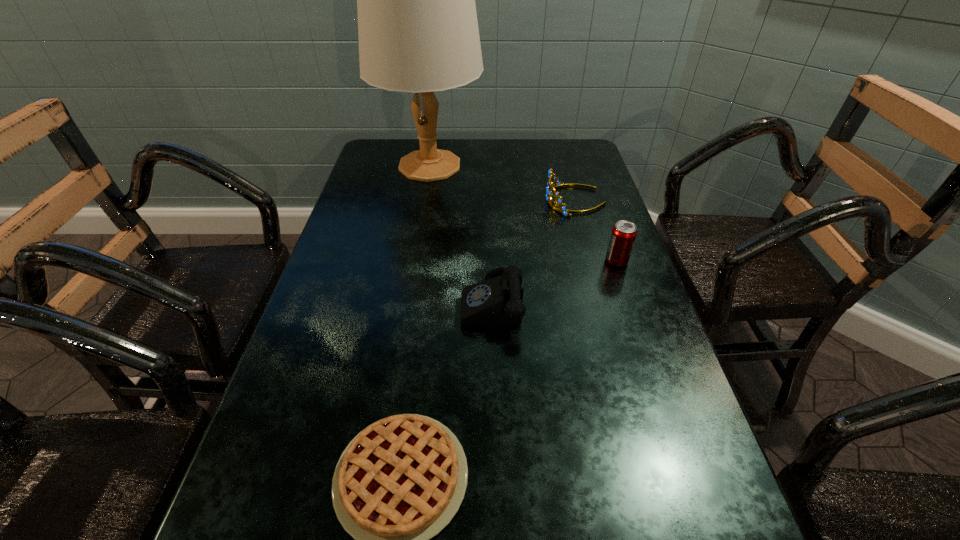
Identify the location of vacant space at the far left corner of the desktop. (376, 159).

This screenshot has width=960, height=540. Identify the location of blank area at the far right corner. (549, 166).

Locate an element on the screen. This screenshot has width=960, height=540. vacant area between the third farthest object and the tiara is located at coordinates (596, 231).

You are a GUI agent. You are given a task and a screenshot of the screen. Output one action in this format:
    pyautogui.click(x=<x>, y=<y>)
    Task: Click on the free point between the table lamp and the fourth farthest object
    
    Given the screenshot: What is the action you would take?
    pyautogui.click(x=461, y=234)

At what (x,y) coordinates should I click in order to perform the action: click on vacant space in between the third farthest object and the tallest object. Please return your answer as a coordinate pair (x, y). The height and width of the screenshot is (540, 960). Looking at the image, I should click on (523, 213).

Locate an element on the screen. empty space between the soda can and the fourth farthest object is located at coordinates (554, 281).

Locate an element on the screen. The height and width of the screenshot is (540, 960). vacant space that's between the soda can and the table lamp is located at coordinates (523, 213).

Locate an element on the screen. This screenshot has height=540, width=960. object that is the fourth closest to the second nearest object is located at coordinates (x=418, y=32).

I want to click on object that is the third nearest to the tiara, so click(496, 302).

Where is `free space that satisfies the following two spatial constraints: 1. on the front side of the soda can; 2. on the left side of the tallest object`? The image size is (960, 540). free space that satisfies the following two spatial constraints: 1. on the front side of the soda can; 2. on the left side of the tallest object is located at coordinates (414, 261).